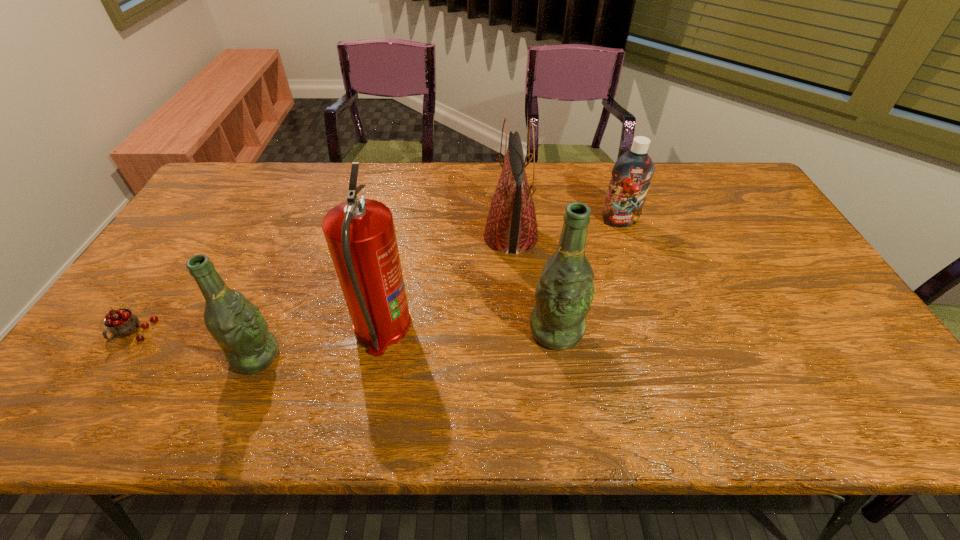
The beer bottles are evenly distributed in the image. To maintain this, where would you place another beer bottle on the right? Please point to a free space. Please provide its 2D coordinates. Your answer should be formatted as a tuple, i.e. [(x, y)], where the tuple contains the x and y coordinates of a point satisfying the conditions above.

[(829, 308)]